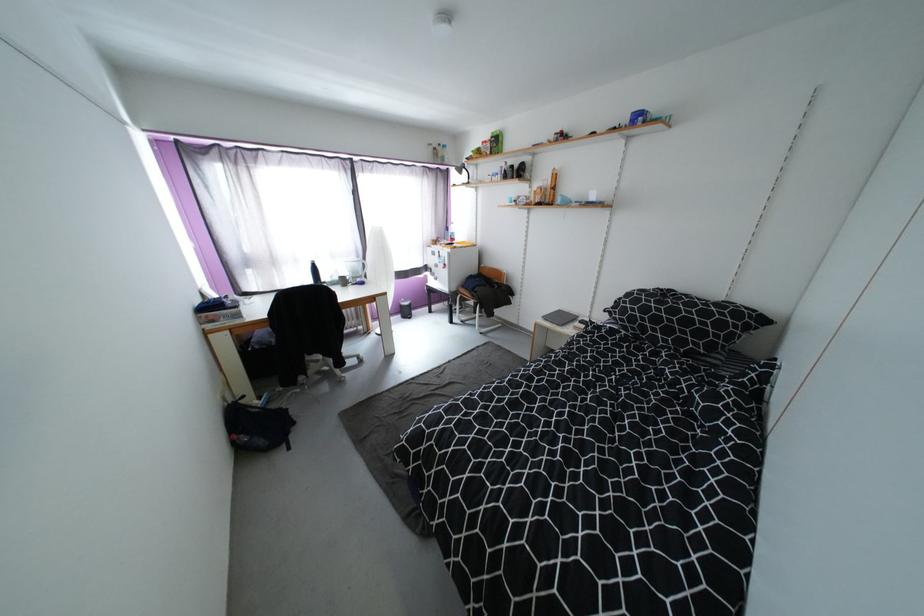
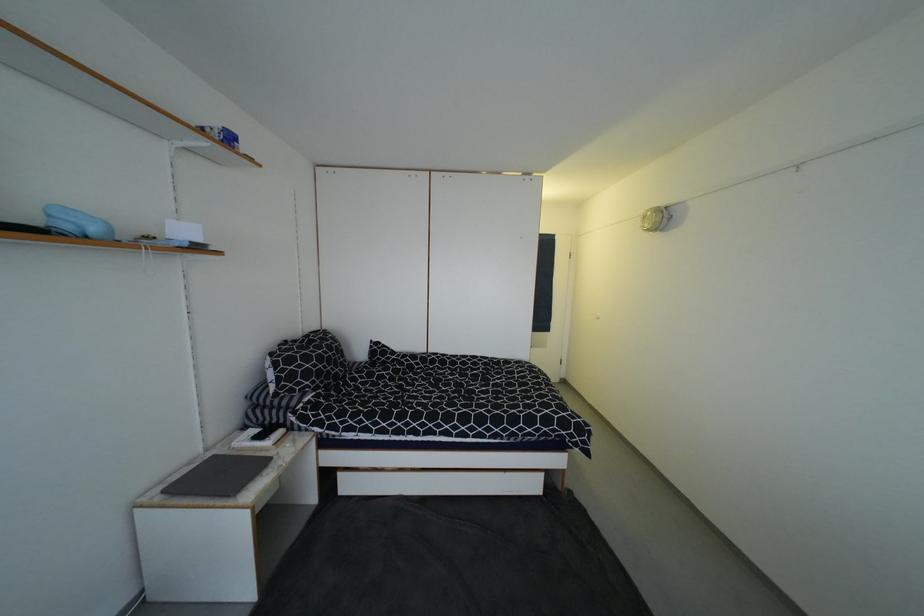
Find the pixel in the second image that matches (630,304) in the first image.

(305, 368)